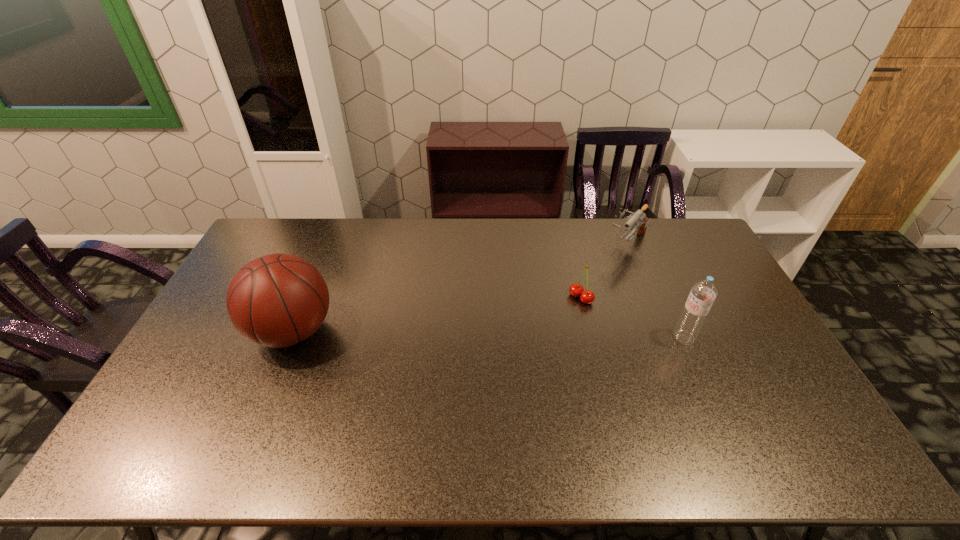
Where is `free spot between the water bottle and the leftmost object`? This screenshot has height=540, width=960. free spot between the water bottle and the leftmost object is located at coordinates (488, 334).

In order to click on vacant space that's between the third tallest object and the cherry in this screenshot , I will do `click(604, 271)`.

Image resolution: width=960 pixels, height=540 pixels. Identify the location of empty space between the third object from right to left and the water bottle. (633, 318).

Locate an element on the screen. This screenshot has height=540, width=960. unoccupied position between the water bottle and the leftmost object is located at coordinates (488, 334).

Identify the location of vacant space that's between the water bottle and the second shortest object. Image resolution: width=960 pixels, height=540 pixels. (655, 291).

The width and height of the screenshot is (960, 540). Identify the location of free space between the farthest object and the water bottle. (655, 291).

Image resolution: width=960 pixels, height=540 pixels. I want to click on vacant space that's between the leftmost object and the cherry, so click(x=437, y=315).

Where is `empty location between the gun and the basketball`? The image size is (960, 540). empty location between the gun and the basketball is located at coordinates (460, 288).

Locate an element on the screen. The image size is (960, 540). free spot between the farthest object and the water bottle is located at coordinates (655, 291).

Select which object is the third closest to the cherry. Please provide its 2D coordinates. Your answer should be formatted as a tuple, i.e. [(x, y)], where the tuple contains the x and y coordinates of a point satisfying the conditions above.

[(278, 300)]